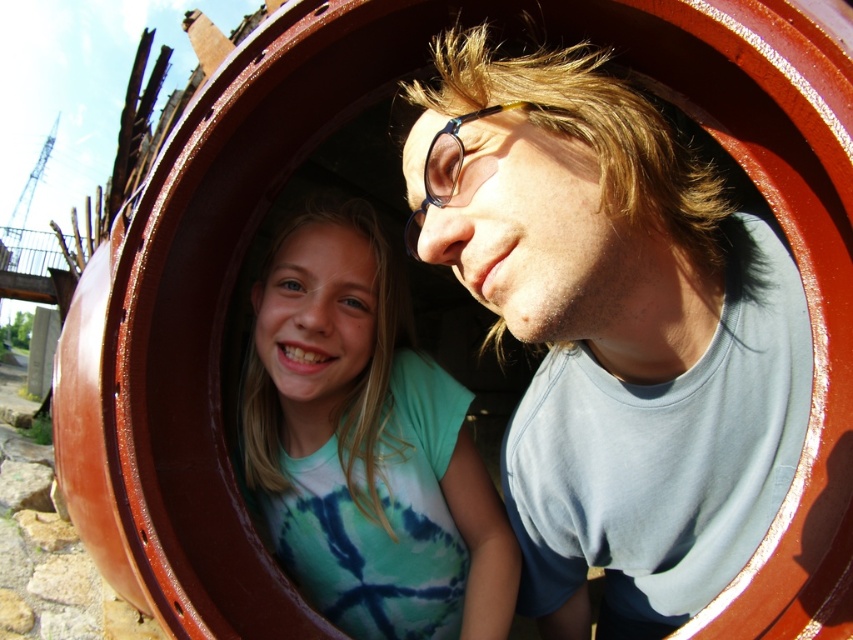
Question: Is tie-dye fabric shirt at center positioned behind blue plastic goggles at center?

Choices:
 (A) no
 (B) yes

Answer: (B)

Question: Does tie-dye fabric shirt at center come behind blue plastic goggles at center?

Choices:
 (A) no
 (B) yes

Answer: (B)

Question: Can you confirm if tie-dye fabric shirt at center is positioned below blue plastic goggles at center?

Choices:
 (A) no
 (B) yes

Answer: (B)

Question: Which point appears farthest from the camera in this image?

Choices:
 (A) (329, 312)
 (B) (486, 246)
 (C) (415, 220)

Answer: (A)

Question: Which of these objects is positioned closest to the matte blue shirt at center?

Choices:
 (A) tie-dye fabric shirt at center
 (B) blue plastic goggles at center

Answer: (B)

Question: Which of these objects is positioned farthest from the tie-dye fabric shirt at center?

Choices:
 (A) blue plastic goggles at center
 (B) matte blue shirt at center

Answer: (A)